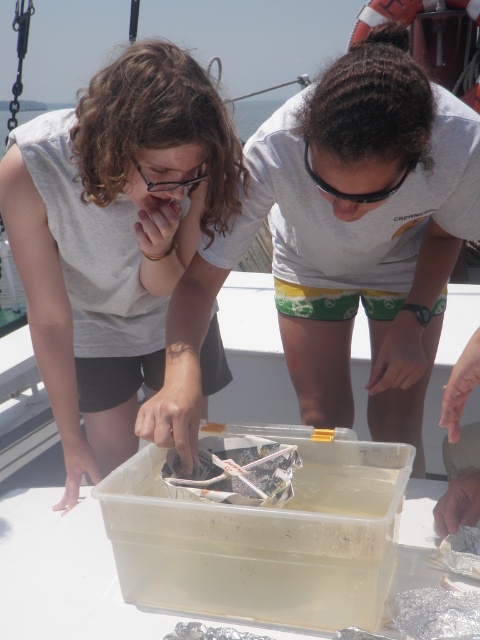
You are a researcher on a boat and need to store two different samples in separate containers. The white matte plastic container at center and the transparent plastic container at center are available. If you want to store a sample that requires more height, which container should you choose?

The white matte plastic container at center is taller than the transparent plastic container at center, so you should choose the white matte plastic container at center for the sample that requires more height.

You are a researcher on a boat observing marine life. You have a clear plastic bag at center and clear plastic goggles at center. Which object is positioned lower in your field of view?

The clear plastic bag at center is located below the clear plastic goggles at center, so the clear plastic bag at center is positioned lower in your field of view.

You are on a boat and need to retrieve a sample from the transparent plastic container at center and the clear plastic goggles at center. Which object should you reach for first to get the sample?

The transparent plastic container at center is closer to the viewer than the clear plastic goggles at center, so you should reach for the transparent plastic container at center first to get the sample.